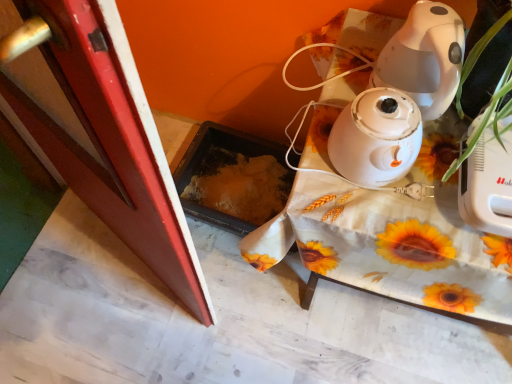
Find the location of a particular element. The image size is (512, 384). vacant area located to the right-hand side of smooth red screen door at left is located at coordinates (250, 274).